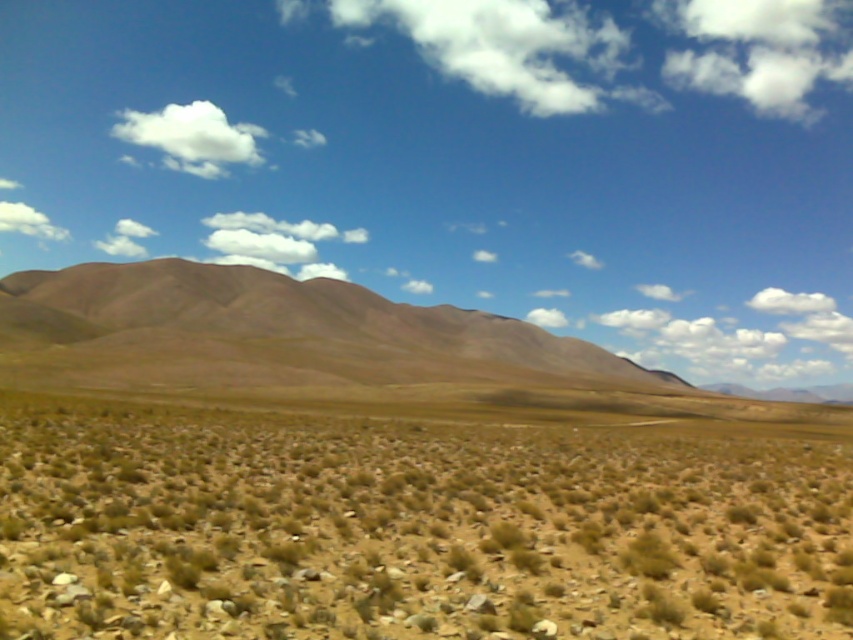
You are an astronaut stranded in a desert and see the brown dry grass at center and the white fluffy cloud at upper center. Which object is closer to you?

The brown dry grass at center is closer to you because it is positioned below the white fluffy cloud at upper center, which is higher up in the sky.